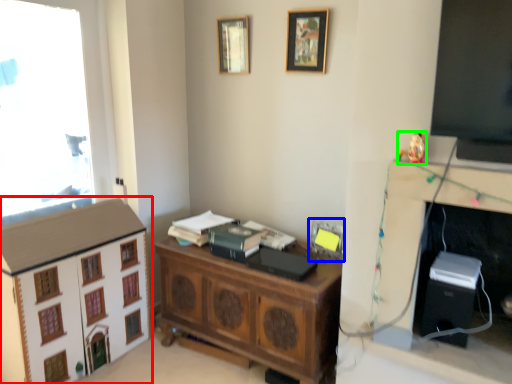
Question: Estimate the real-world distances between objects in this image. Which object is closer to dresser (highlighted by a red box), picture frame (highlighted by a blue box) or toy (highlighted by a green box)?

Choices:
 (A) picture frame
 (B) toy

Answer: (A)